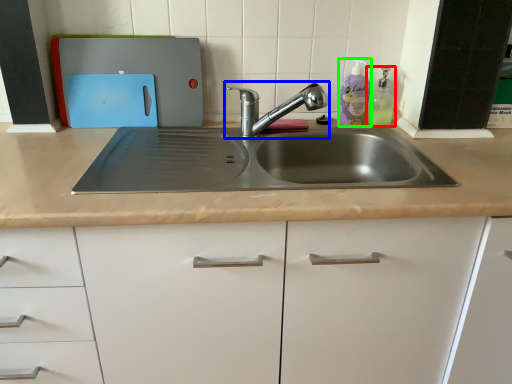
Question: Which object is the farthest from soap dispenser (highlighted by a red box)? Choose among these: tap (highlighted by a blue box) or cleaning product (highlighted by a green box).

Choices:
 (A) tap
 (B) cleaning product

Answer: (A)